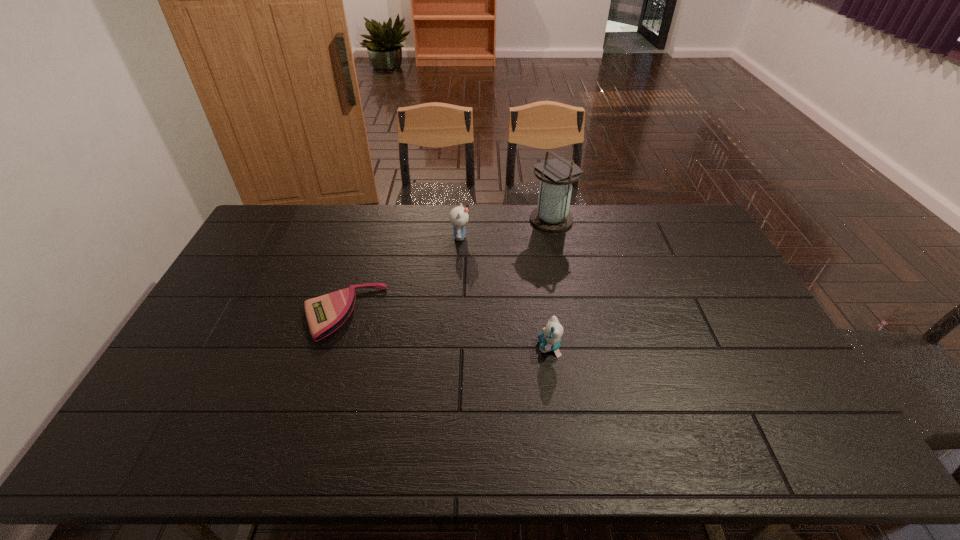
The image size is (960, 540). What are the coordinates of `vacant space at the far right corner` in the screenshot? It's located at (671, 215).

The image size is (960, 540). In the image, there is a desktop. In order to click on vacant space at the near right corner in this screenshot , I will do `click(822, 460)`.

This screenshot has height=540, width=960. In order to click on blank region between the shorter kitten and the farther kitten in this screenshot , I will do `click(505, 292)`.

Find the location of a particular element. The height and width of the screenshot is (540, 960). empty location between the shorter kitten and the lantern is located at coordinates (550, 283).

This screenshot has width=960, height=540. In order to click on free spot between the right kitten and the taller kitten in this screenshot , I will do `click(505, 292)`.

In order to click on vacant space that is in between the shortest object and the shorter kitten in this screenshot , I will do point(445,330).

Locate an element on the screen. free space between the leftmost object and the right kitten is located at coordinates (445, 330).

At what (x,y) coordinates should I click in order to perform the action: click on unoccupied area between the tallest object and the second object from left to right. Please return your answer as a coordinate pair (x, y). This screenshot has width=960, height=540. Looking at the image, I should click on (506, 228).

Find the location of a particular element. The image size is (960, 540). free space that is in between the shortest object and the third shortest object is located at coordinates pyautogui.click(x=401, y=275).

Where is `vacant point located between the second tallest object and the wristlet`? vacant point located between the second tallest object and the wristlet is located at coordinates (401, 275).